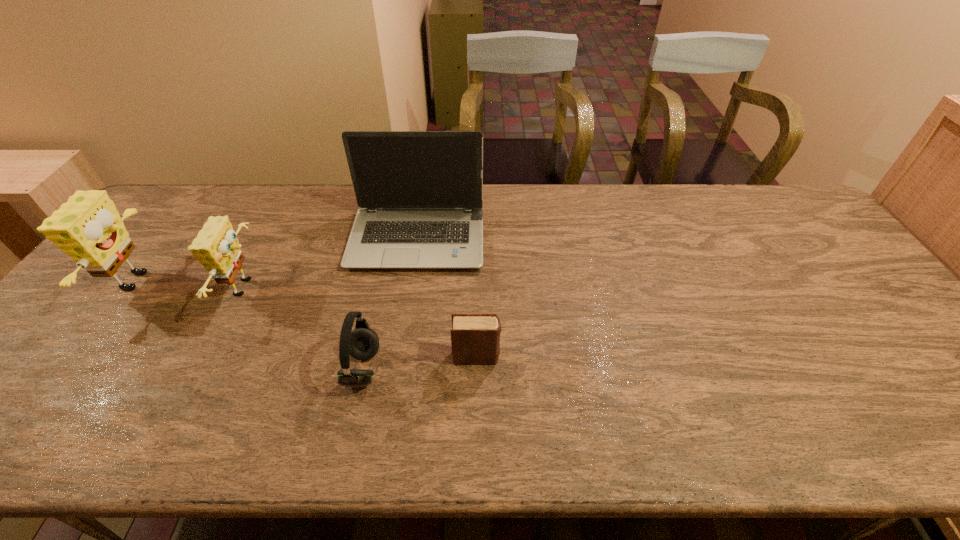
The image size is (960, 540). Find the location of `free space located on the ear cups of the fourth tallest object`. free space located on the ear cups of the fourth tallest object is located at coordinates (430, 369).

Identify the location of free space located 0.350m on the spine side of the diary. The height and width of the screenshot is (540, 960). (645, 357).

Find the location of a particular element. This screenshot has width=960, height=540. object positioned at the far edge is located at coordinates pyautogui.click(x=420, y=193).

This screenshot has width=960, height=540. Find the location of `object at the left edge`. object at the left edge is located at coordinates (88, 228).

The height and width of the screenshot is (540, 960). In the image, there is a desktop. Find the location of `blank space at the far edge`. blank space at the far edge is located at coordinates (560, 208).

The image size is (960, 540). I want to click on free space at the near edge, so click(x=200, y=440).

Image resolution: width=960 pixels, height=540 pixels. What are the coordinates of `vacant space at the left edge` in the screenshot? It's located at (91, 286).

Find the location of a particular element. Image resolution: width=960 pixels, height=540 pixels. vacant space at the far right corner of the desktop is located at coordinates (794, 200).

This screenshot has width=960, height=540. In order to click on unoccupied position between the headset and the third tallest object in this screenshot , I will do `click(304, 328)`.

The width and height of the screenshot is (960, 540). What are the coordinates of `vacant space in between the right sponge and the headset` in the screenshot? It's located at (304, 328).